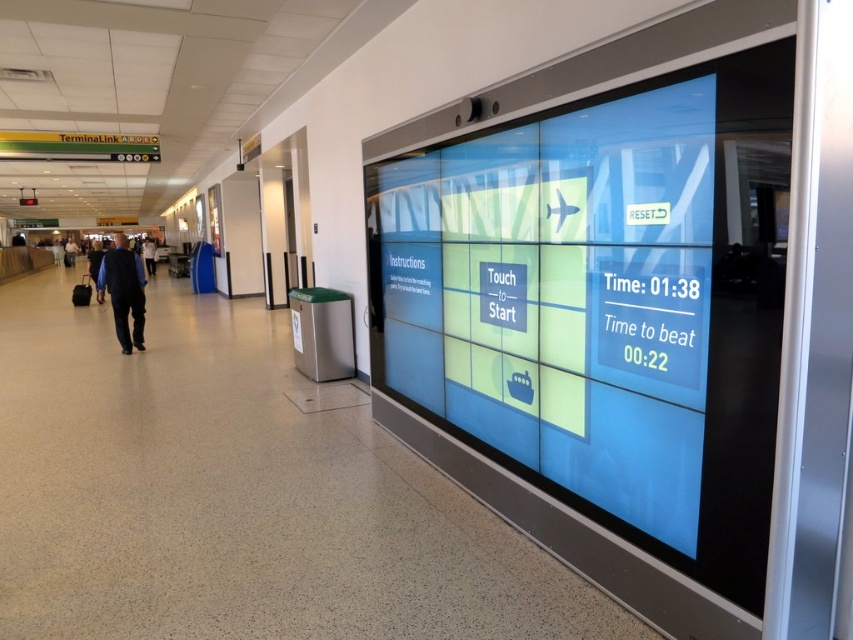
Question: Which point appears farthest from the camera in this image?

Choices:
 (A) (119, 332)
 (B) (65, 260)

Answer: (B)

Question: Is blue glossy screen at right below black suit at left?

Choices:
 (A) yes
 (B) no

Answer: (A)

Question: Does dark blue suit at left come in front of black suit at left?

Choices:
 (A) no
 (B) yes

Answer: (B)

Question: Among these points, which one is nearest to the camera?

Choices:
 (A) (74, 259)
 (B) (695, 168)

Answer: (B)

Question: Is dark blue suit at left further to the viewer compared to black suit at left?

Choices:
 (A) yes
 (B) no

Answer: (B)

Question: Which point is closer to the camera taking this photo?

Choices:
 (A) (74, 246)
 (B) (637, 314)

Answer: (B)